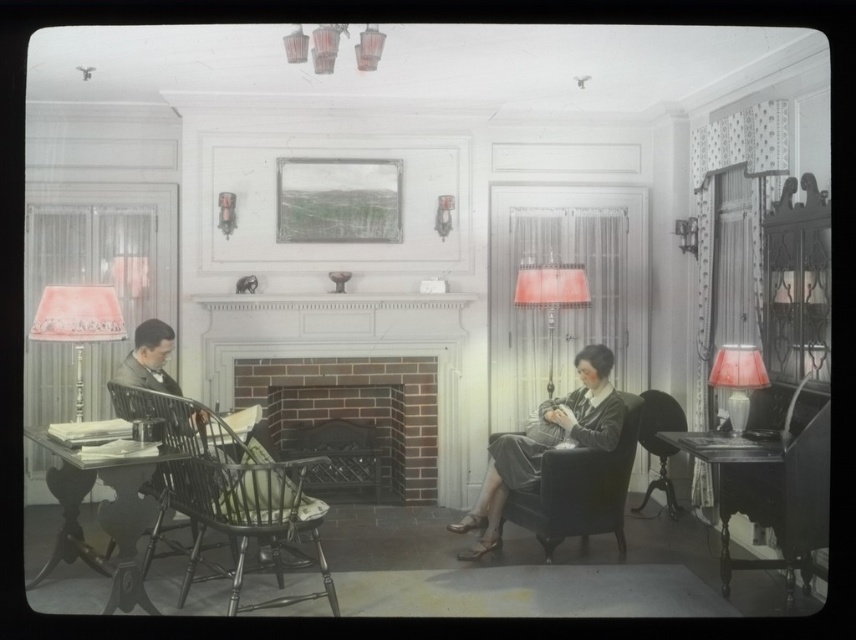
Question: Can you confirm if brick fireplace at center is smaller than matte red lampshade at right?

Choices:
 (A) yes
 (B) no

Answer: (B)

Question: Is wooden woven armchair at left further to camera compared to velvet dark green armchair at right?

Choices:
 (A) yes
 (B) no

Answer: (B)

Question: Does pink velvet lampshade at left have a greater width compared to velvet dark green armchair at right?

Choices:
 (A) no
 (B) yes

Answer: (B)

Question: Which of the following is the farthest from the observer?

Choices:
 (A) (114, 384)
 (B) (349, 387)
 (C) (551, 288)
 (D) (642, 406)

Answer: (B)

Question: Which point is closer to the camera taking this photo?

Choices:
 (A) (728, 586)
 (B) (747, 385)
 (C) (431, 380)

Answer: (A)

Question: Estimate the real-world distances between objects in this image. Which object is closer to the matte red lampshade at center right?

Choices:
 (A) wooden table at left
 (B) velvet dark blue armchair at center
 (C) wooden woven armchair at left
 (D) velvet dark green armchair at right

Answer: (B)